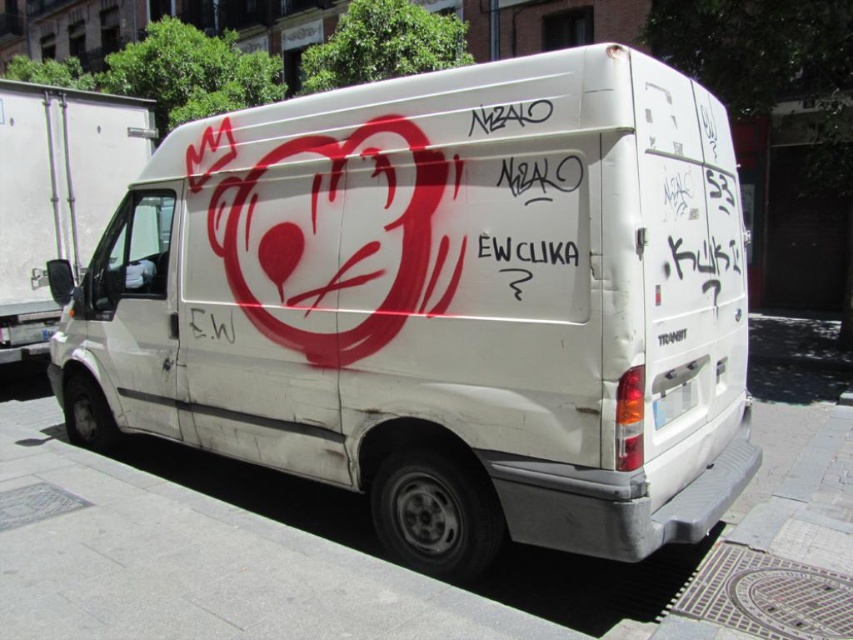
This screenshot has height=640, width=853. Identify the location of white matte van at center. (440, 305).

Which is behind, point (256, 204) or point (122, 180)?

The point (122, 180) is behind.

This screenshot has height=640, width=853. Identify the location of white matte van at center. (440, 305).